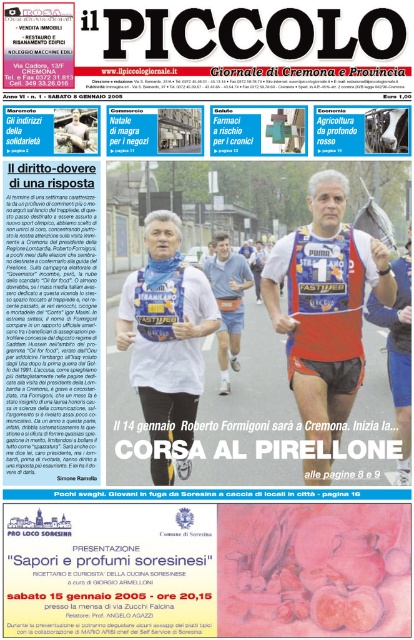
Question: Which object is positioned farthest from the blue fabric shirt at center?

Choices:
 (A) blue fabric runner at center
 (B) white fabric vest at center

Answer: (A)

Question: Estimate the real-world distances between objects in this image. Which object is farther from the blue fabric shirt at center?

Choices:
 (A) white fabric vest at center
 (B) blue fabric runner at center

Answer: (B)

Question: Observing the image, what is the correct spatial positioning of blue fabric runner at center in reference to blue fabric shirt at center?

Choices:
 (A) below
 (B) above

Answer: (A)

Question: Estimate the real-world distances between objects in this image. Which object is farther from the blue fabric runner at center?

Choices:
 (A) blue fabric shirt at center
 (B) white fabric vest at center

Answer: (A)

Question: Does blue fabric runner at center have a larger size compared to blue fabric shirt at center?

Choices:
 (A) yes
 (B) no

Answer: (A)

Question: Can you confirm if blue fabric runner at center is positioned above white fabric vest at center?

Choices:
 (A) yes
 (B) no

Answer: (A)